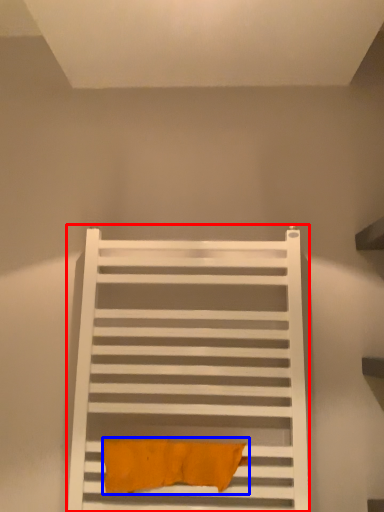
Question: Which object appears closest to the camera in this image, furniture (highlighted by a red box) or bath towel (highlighted by a blue box)?

Choices:
 (A) furniture
 (B) bath towel

Answer: (A)